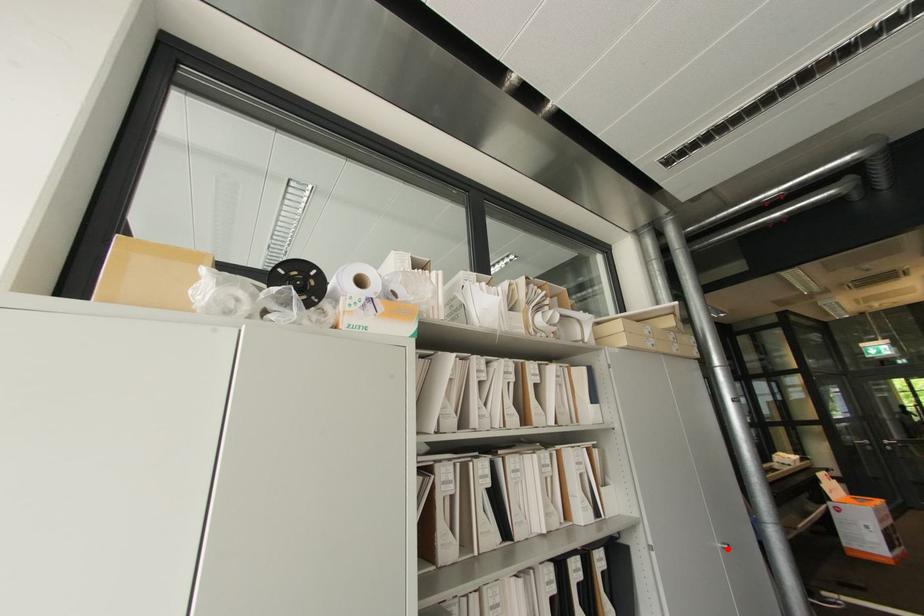
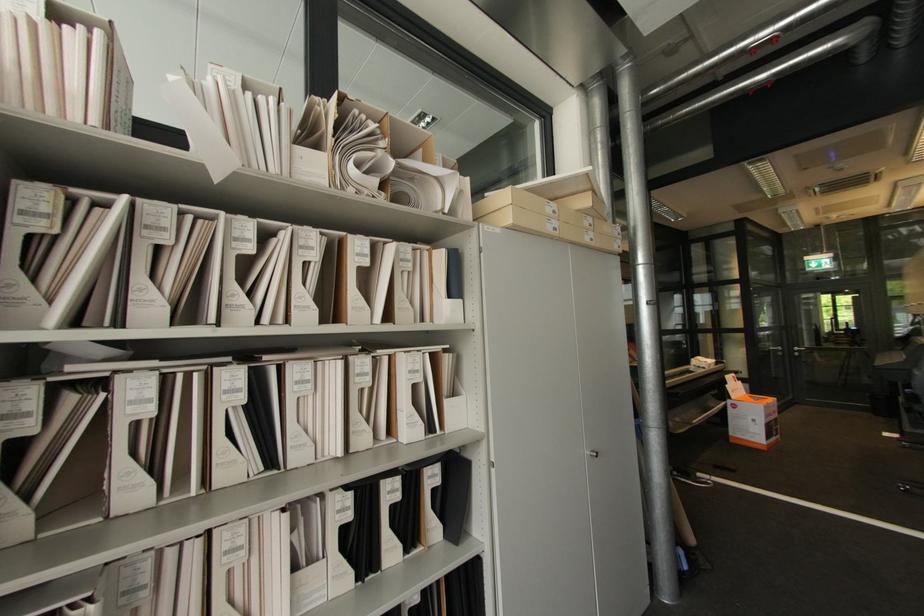
Question: A red point is marked in image1. In image2, is the corresponding 3D point closer to the camera or farther? Reply with the corresponding letter.

Choices:
 (A) The corresponding 3D point is closer.
 (B) The corresponding 3D point is farther.

Answer: (B)